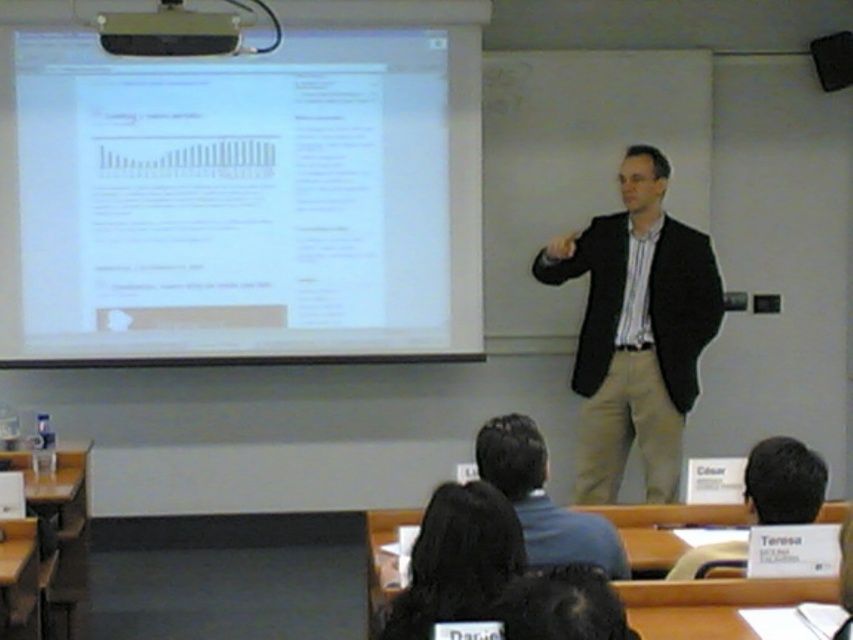
Is white paper at upper left smaller than black plastic projector at upper center?

Actually, white paper at upper left might be larger than black plastic projector at upper center.

Is white paper at upper left to the left of black plastic projector at upper center from the viewer's perspective?

In fact, white paper at upper left is to the right of black plastic projector at upper center.

Is point (241, 200) farther from camera compared to point (143, 52)?

That is True.

Locate an element on the screen. The height and width of the screenshot is (640, 853). white paper at upper left is located at coordinates (241, 198).

Can you confirm if black plastic projector at upper center is thinner than matte black laptop at center?

In fact, black plastic projector at upper center might be wider than matte black laptop at center.

Based on the photo, who is lower down, black plastic projector at upper center or matte black laptop at center?

black plastic projector at upper center is below.

The height and width of the screenshot is (640, 853). What do you see at coordinates (169, 33) in the screenshot?
I see `black plastic projector at upper center` at bounding box center [169, 33].

The width and height of the screenshot is (853, 640). I want to click on black plastic projector at upper center, so click(x=169, y=33).

Is brown hair at upper center above black plastic projector at upper center?

Incorrect, brown hair at upper center is not positioned above black plastic projector at upper center.

Is brown hair at upper center positioned before black plastic projector at upper center?

Yes, brown hair at upper center is in front of black plastic projector at upper center.

Is point (788, 461) positioned before point (189, 42)?

Yes, it is in front of point (189, 42).

You are a GUI agent. You are given a task and a screenshot of the screen. Output one action in this format:
    pyautogui.click(x=<x>, y=<y>)
    Task: Click on the brown hair at upper center
    This screenshot has width=853, height=640.
    Given the screenshot: What is the action you would take?
    pyautogui.click(x=782, y=481)